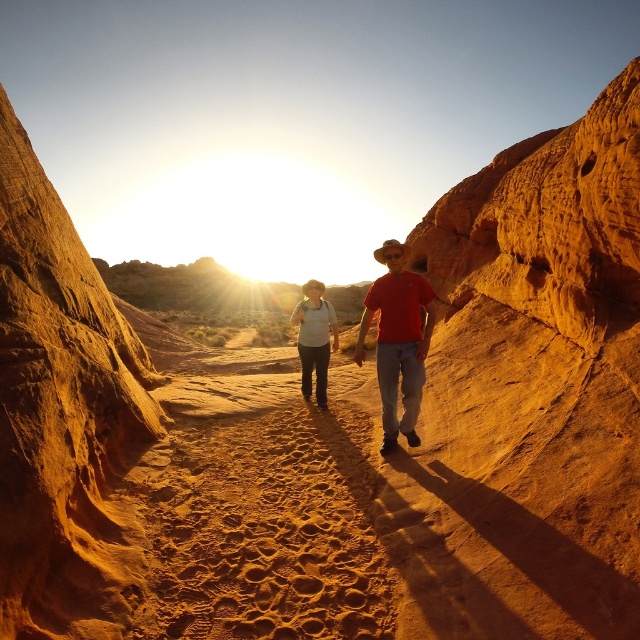
You are planning to take a photo of the desert scene. You want to ensure both the smooth sandstone rock at left and the matte white shirt at center are clearly visible. Considering their sizes, which object should you focus on to ensure both are in frame?

The smooth sandstone rock at left is bigger than the matte white shirt at center, so focusing on the smooth sandstone rock at left would ensure both are in frame as it takes up more space in the image.

You are a hiker planning to take a photo of the smooth sandstone rock at left and the matte red shirt at center. Based on their positions, which object should you focus on first to ensure both are in clear view?

The smooth sandstone rock at left is closer to the viewer than the matte red shirt at center, so focus on the smooth sandstone rock at left first to ensure both are in clear view.